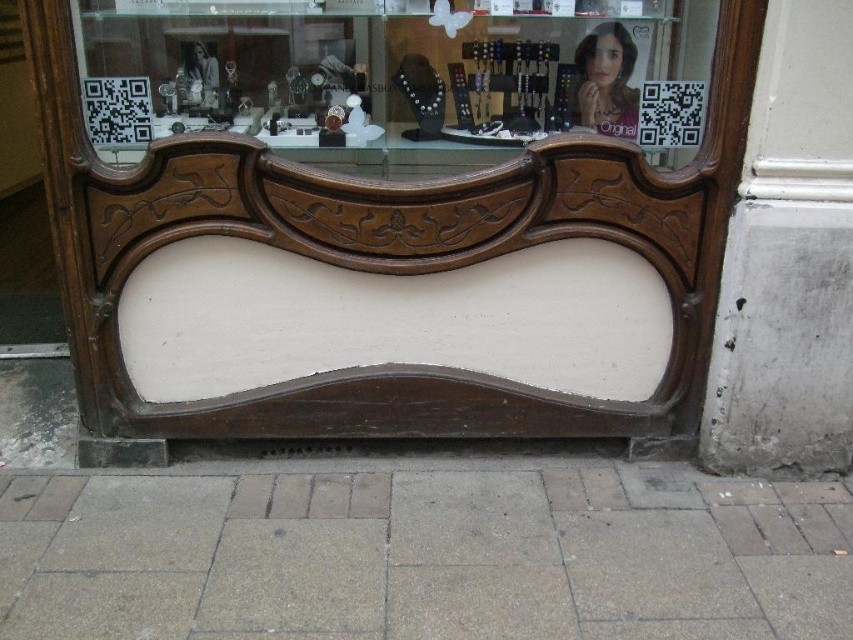
Between gray concrete pavement at lower center and wooden carved frame at center, which one appears on the right side from the viewer's perspective?

gray concrete pavement at lower center

Locate an element on the screen. This screenshot has width=853, height=640. gray concrete pavement at lower center is located at coordinates (424, 556).

The height and width of the screenshot is (640, 853). I want to click on gray concrete pavement at lower center, so (x=424, y=556).

Is gray concrete pavement at lower center to the left of smooth skin face at upper right from the viewer's perspective?

Indeed, gray concrete pavement at lower center is positioned on the left side of smooth skin face at upper right.

Is point (107, 484) less distant than point (582, 51)?

No, it is not.

Who is more distant from viewer, [567,524] or [611,124]?

The point [611,124] is behind.

Where is `gray concrete pavement at lower center`? gray concrete pavement at lower center is located at coordinates (424, 556).

Is point (613, 72) positioned in front of point (627, 97)?

Yes, it is in front of point (627, 97).

Does point (492, 72) come behind point (595, 38)?

Yes.

The width and height of the screenshot is (853, 640). I want to click on wooden carved frame at center, so click(x=396, y=76).